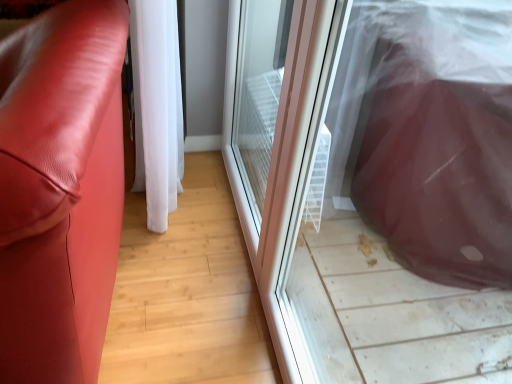
The width and height of the screenshot is (512, 384). What do you see at coordinates (60, 190) in the screenshot?
I see `matte leather couch at left` at bounding box center [60, 190].

This screenshot has height=384, width=512. I want to click on transparent plastic screen door at right, which is the second screen door in back-to-front order, so click(376, 183).

How many degrees apart are the facing directions of matte leather couch at left and transparent plastic screen door at center, the 1th screen door when ordered from back to front?

The angular difference between matte leather couch at left and transparent plastic screen door at center, the 1th screen door when ordered from back to front, is 6.19 degrees.

Is the position of matte leather couch at left more distant than that of transparent plastic screen door at center, arranged as the 2th screen door when viewed from the front?

No, the depth of matte leather couch at left is less than that of transparent plastic screen door at center, arranged as the 2th screen door when viewed from the front.

From a real-world perspective, count 1st screen doors upward from the matte leather couch at left and point to it. Please provide its 2D coordinates.

[(280, 146)]

From the image's perspective, which one is positioned lower, matte leather couch at left or transparent plastic screen door at center, the 1th screen door when ordered from back to front?

matte leather couch at left appears lower in the image.

Is transparent plastic screen door at right, which is the second screen door in back-to-front order, to the left of matte leather couch at left from the viewer's perspective?

Incorrect, transparent plastic screen door at right, which is the second screen door in back-to-front order, is not on the left side of matte leather couch at left.

Is transparent plastic screen door at right, the 1th screen door in the front-to-back sequence, oriented towards matte leather couch at left?

Yes, transparent plastic screen door at right, the 1th screen door in the front-to-back sequence, is oriented towards matte leather couch at left.

Are transparent plastic screen door at right, which is the second screen door in back-to-front order, and matte leather couch at left located far from each other?

No, transparent plastic screen door at right, which is the second screen door in back-to-front order, is not far from matte leather couch at left.

Which object is thinner, transparent plastic screen door at right, the 1th screen door in the front-to-back sequence, or matte leather couch at left?

transparent plastic screen door at right, the 1th screen door in the front-to-back sequence.

Based on the photo, is white sheer curtain at center wider or thinner than transparent plastic screen door at right, the 1th screen door in the front-to-back sequence?

Clearly, white sheer curtain at center has more width compared to transparent plastic screen door at right, the 1th screen door in the front-to-back sequence.

Considering their positions, is white sheer curtain at center located in front of or behind transparent plastic screen door at right, the 1th screen door in the front-to-back sequence?

In the image, white sheer curtain at center appears behind transparent plastic screen door at right, the 1th screen door in the front-to-back sequence.

From the image's perspective, is white sheer curtain at center located above or below transparent plastic screen door at right, the 1th screen door in the front-to-back sequence?

Based on their image positions, white sheer curtain at center is located above transparent plastic screen door at right, the 1th screen door in the front-to-back sequence.

Is the surface of transparent plastic screen door at center, arranged as the 2th screen door when viewed from the front, in direct contact with transparent plastic screen door at right, which is the second screen door in back-to-front order?

No, transparent plastic screen door at center, arranged as the 2th screen door when viewed from the front, is not making contact with transparent plastic screen door at right, which is the second screen door in back-to-front order.

Which object is wider, transparent plastic screen door at center, the 1th screen door when ordered from back to front, or transparent plastic screen door at right, the 1th screen door in the front-to-back sequence?

transparent plastic screen door at right, the 1th screen door in the front-to-back sequence.

From a real-world perspective, which is physically below, transparent plastic screen door at center, the 1th screen door when ordered from back to front, or transparent plastic screen door at right, which is the second screen door in back-to-front order?

transparent plastic screen door at center, the 1th screen door when ordered from back to front, is physically lower.

In the scene shown: Is transparent plastic screen door at center, arranged as the 2th screen door when viewed from the front, located outside transparent plastic screen door at right, the 1th screen door in the front-to-back sequence?

Yes.

Are matte leather couch at left and transparent plastic screen door at right, the 1th screen door in the front-to-back sequence, located far from each other?

Actually, matte leather couch at left and transparent plastic screen door at right, the 1th screen door in the front-to-back sequence, are a little close together.

Is matte leather couch at left at the right side of transparent plastic screen door at right, which is the second screen door in back-to-front order?

No, matte leather couch at left is not to the right of transparent plastic screen door at right, which is the second screen door in back-to-front order.

From the picture: From their relative heights in the image, would you say matte leather couch at left is taller or shorter than transparent plastic screen door at right, which is the second screen door in back-to-front order?

Considering their sizes, matte leather couch at left has less height than transparent plastic screen door at right, which is the second screen door in back-to-front order.

Is point (172, 169) positioned in front of point (71, 58)?

No, (172, 169) is further to viewer.

From the image's perspective, is white sheer curtain at center located above or below matte leather couch at left?

Clearly, from the image's perspective, white sheer curtain at center is above matte leather couch at left.

Is white sheer curtain at center not inside matte leather couch at left?

Yes.

Is transparent plastic screen door at right, which is the second screen door in back-to-front order, not within transparent plastic screen door at center, arranged as the 2th screen door when viewed from the front?

Yes, transparent plastic screen door at right, which is the second screen door in back-to-front order, is not within transparent plastic screen door at center, arranged as the 2th screen door when viewed from the front.

Considering the positions of objects transparent plastic screen door at right, the 1th screen door in the front-to-back sequence, and transparent plastic screen door at center, the 1th screen door when ordered from back to front, in the image provided, who is behind, transparent plastic screen door at right, the 1th screen door in the front-to-back sequence, or transparent plastic screen door at center, the 1th screen door when ordered from back to front,?

transparent plastic screen door at center, the 1th screen door when ordered from back to front, is further away from the camera.

Which of these two, transparent plastic screen door at right, which is the second screen door in back-to-front order, or transparent plastic screen door at center, the 1th screen door when ordered from back to front, is smaller?

transparent plastic screen door at right, which is the second screen door in back-to-front order.

At what (x,y) coordinates should I click in order to perform the action: click on screen door in front of the transparent plastic screen door at center, the 1th screen door when ordered from back to front. Please return your answer as a coordinate pair (x, y). Looking at the image, I should click on (376, 183).

Which screen door is the 1st one when counting from the right side of the matte leather couch at left? Please provide its 2D coordinates.

[(280, 146)]

From a real-world perspective, starting from the matte leather couch at left, which screen door is the 2nd one vertically above it? Please provide its 2D coordinates.

[(376, 183)]

Which object lies further to the anchor point matte leather couch at left, transparent plastic screen door at right, which is the second screen door in back-to-front order, or transparent plastic screen door at center, the 1th screen door when ordered from back to front?

The object further to matte leather couch at left is transparent plastic screen door at right, which is the second screen door in back-to-front order.

Looking at the image, which one is located closer to transparent plastic screen door at center, arranged as the 2th screen door when viewed from the front, transparent plastic screen door at right, the 1th screen door in the front-to-back sequence, or white sheer curtain at center?

Among the two, transparent plastic screen door at right, the 1th screen door in the front-to-back sequence, is located nearer to transparent plastic screen door at center, arranged as the 2th screen door when viewed from the front.

From the image, which object appears to be farther from white sheer curtain at center, matte leather couch at left or transparent plastic screen door at center, the 1th screen door when ordered from back to front?

The object further to white sheer curtain at center is transparent plastic screen door at center, the 1th screen door when ordered from back to front.

When comparing their distances from transparent plastic screen door at right, the 1th screen door in the front-to-back sequence, does white sheer curtain at center or transparent plastic screen door at center, the 1th screen door when ordered from back to front, seem further?

white sheer curtain at center.

Looking at the image, which one is located further to transparent plastic screen door at right, which is the second screen door in back-to-front order, matte leather couch at left or white sheer curtain at center?

matte leather couch at left is further to transparent plastic screen door at right, which is the second screen door in back-to-front order.

Based on their spatial positions, is white sheer curtain at center or matte leather couch at left further from transparent plastic screen door at center, arranged as the 2th screen door when viewed from the front?

Among the two, matte leather couch at left is located further to transparent plastic screen door at center, arranged as the 2th screen door when viewed from the front.

Estimate the real-world distances between objects in this image. Which object is further from matte leather couch at left, transparent plastic screen door at center, arranged as the 2th screen door when viewed from the front, or white sheer curtain at center?

A: transparent plastic screen door at center, arranged as the 2th screen door when viewed from the front.

When comparing their distances from transparent plastic screen door at right, which is the second screen door in back-to-front order, does matte leather couch at left or transparent plastic screen door at center, arranged as the 2th screen door when viewed from the front, seem closer?

transparent plastic screen door at center, arranged as the 2th screen door when viewed from the front.

Locate an element on the screen. This screenshot has height=384, width=512. screen door between matte leather couch at left and transparent plastic screen door at right, the 1th screen door in the front-to-back sequence, from left to right is located at coordinates (280, 146).

Identify the location of screen door between transparent plastic screen door at right, which is the second screen door in back-to-front order, and white sheer curtain at center, along the z-axis. (280, 146).

Locate an element on the screen. The image size is (512, 384). screen door between matte leather couch at left and white sheer curtain at center along the z-axis is located at coordinates (280, 146).

Find the location of `furniture between transparent plastic screen door at right, which is the second screen door in back-to-front order, and white sheer curtain at center from front to back`. furniture between transparent plastic screen door at right, which is the second screen door in back-to-front order, and white sheer curtain at center from front to back is located at coordinates (60, 190).